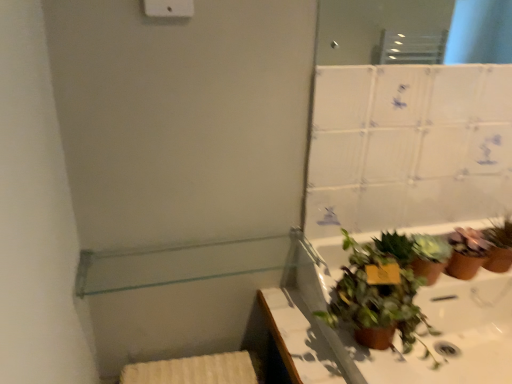
Question: Does white plastic light switch at upper center have a lesser height compared to brown matte pot at right, the first houseplant viewed from the right?

Choices:
 (A) no
 (B) yes

Answer: (A)

Question: From a real-world perspective, is white plastic light switch at upper center located higher than brown matte pot at right, the first houseplant viewed from the right?

Choices:
 (A) no
 (B) yes

Answer: (B)

Question: From the image's perspective, is white plastic light switch at upper center under brown matte pot at right, the second houseplant viewed from the left?

Choices:
 (A) no
 (B) yes

Answer: (A)

Question: From a real-world perspective, is white plastic light switch at upper center positioned under brown matte pot at right, the second houseplant viewed from the left, based on gravity?

Choices:
 (A) no
 (B) yes

Answer: (A)

Question: Considering the relative sizes of white plastic light switch at upper center and brown matte pot at right, the first houseplant viewed from the right, in the image provided, is white plastic light switch at upper center taller than brown matte pot at right, the first houseplant viewed from the right,?

Choices:
 (A) yes
 (B) no

Answer: (A)

Question: Is point (155, 1) positioned closer to the camera than point (315, 345)?

Choices:
 (A) closer
 (B) farther

Answer: (A)

Question: Considering the positions of white plastic light switch at upper center and brown matte plant pot at lower right in the image, is white plastic light switch at upper center taller or shorter than brown matte plant pot at lower right?

Choices:
 (A) tall
 (B) short

Answer: (B)

Question: Based on their sizes in the image, would you say white plastic light switch at upper center is bigger or smaller than brown matte plant pot at lower right?

Choices:
 (A) big
 (B) small

Answer: (B)

Question: From a real-world perspective, relative to brown matte plant pot at lower right, is white plastic light switch at upper center vertically above or below?

Choices:
 (A) above
 (B) below

Answer: (A)

Question: In the image, is clear glass shelf at upper left on the left side or the right side of brown matte plant pot at lower right?

Choices:
 (A) left
 (B) right

Answer: (A)

Question: From the image's perspective, relative to brown matte plant pot at lower right, is clear glass shelf at upper left above or below?

Choices:
 (A) below
 (B) above

Answer: (B)

Question: From a real-world perspective, relative to brown matte plant pot at lower right, is clear glass shelf at upper left vertically above or below?

Choices:
 (A) above
 (B) below

Answer: (A)

Question: Is clear glass shelf at upper left taller or shorter than brown matte plant pot at lower right?

Choices:
 (A) tall
 (B) short

Answer: (B)

Question: Does point (425, 284) appear closer or farther from the camera than point (457, 236)?

Choices:
 (A) closer
 (B) farther

Answer: (A)

Question: Choose the correct answer: Is green matte plant at lower right, marked as the 2th houseplant in a right-to-left arrangement, inside brown matte pot at right, the second houseplant viewed from the left, or outside it?

Choices:
 (A) outside
 (B) inside

Answer: (A)